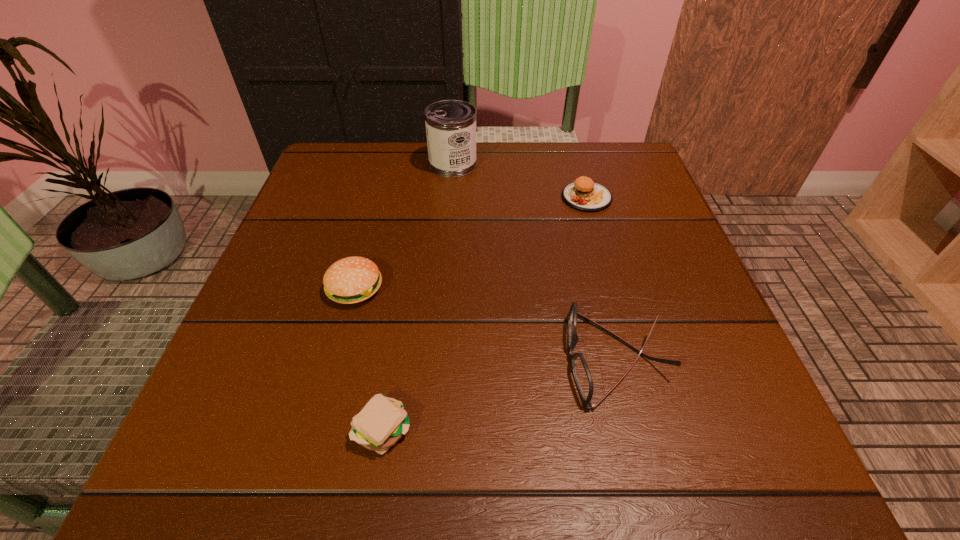
Where is `free space located 0.130m on the front-facing side of the spectacles`? free space located 0.130m on the front-facing side of the spectacles is located at coordinates (484, 359).

This screenshot has width=960, height=540. Find the location of `free space located on the back of the third nearest object`. free space located on the back of the third nearest object is located at coordinates (382, 185).

Locate an element on the screen. Image resolution: width=960 pixels, height=540 pixels. vacant space located on the back of the shortest patty is located at coordinates (392, 372).

At what (x,y) coordinates should I click in order to perform the action: click on object positioned at the far edge. Please return your answer as a coordinate pair (x, y). Looking at the image, I should click on (564, 424).

Identify the location of object present at the near edge. The width and height of the screenshot is (960, 540). (644, 185).

You are a GUI agent. You are given a task and a screenshot of the screen. Output one action in this format:
    pyautogui.click(x=<x>, y=<y>)
    Task: Click on the object that is at the left edge
    
    Given the screenshot: What is the action you would take?
    pyautogui.click(x=506, y=223)

Locate an element on the screen. patty that is at the right edge is located at coordinates (564, 424).

Image resolution: width=960 pixels, height=540 pixels. Find the location of `spectacles that is at the right edge`. spectacles that is at the right edge is located at coordinates (357, 146).

This screenshot has height=540, width=960. I want to click on object situated at the far right corner, so click(x=564, y=424).

Locate an element on the screen. This screenshot has height=540, width=960. vacant space at the far edge of the desktop is located at coordinates (493, 189).